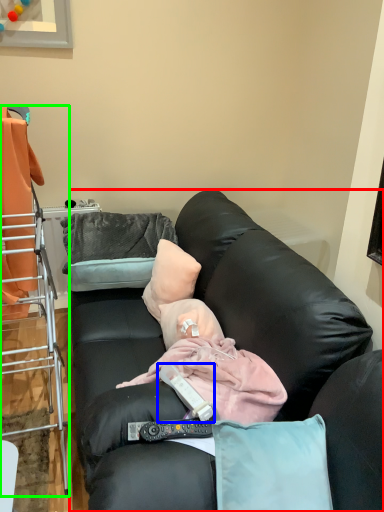
Question: Which object is positioned closest to studio couch (highlighted by a red box)? Select from remote control (highlighted by a blue box) and cabinetry (highlighted by a green box).

Choices:
 (A) remote control
 (B) cabinetry

Answer: (A)